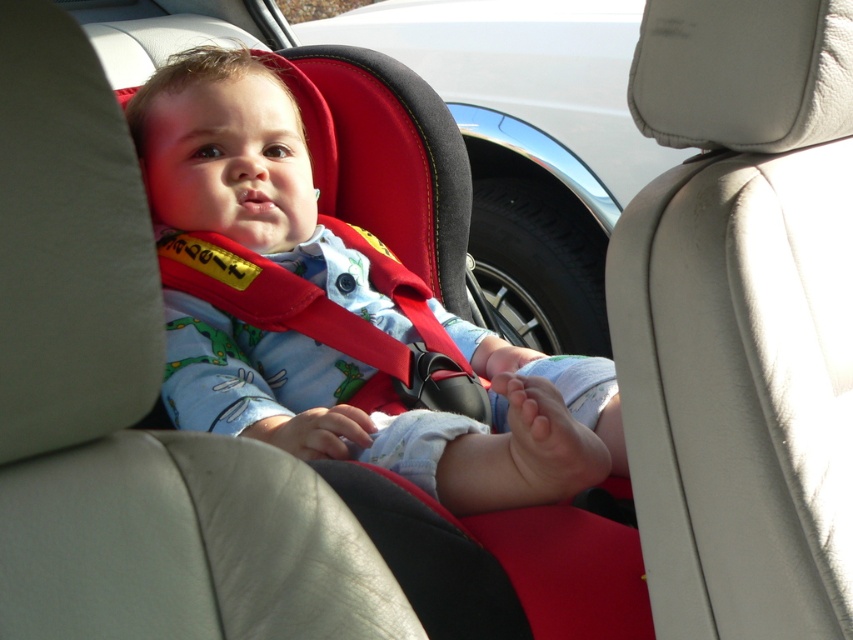
You are a parent checking the car seats in your vehicle. You notice the matte red car seat at center and the matte black car seat at upper center. Which one is positioned lower in the vehicle?

The matte red car seat at center is positioned lower than the matte black car seat at upper center, so the matte red car seat at center is lower in the vehicle.

You are a parent trying to secure your baby in the car. You have a 3.5 feet long strap to connect the two car seats. Will the strap be long enough to reach between the matte red car seat at center and the matte black car seat at upper center?

The matte red car seat at center and the matte black car seat at upper center are 5.09 feet apart from each other. Since the strap is only 3.5 feet long, it will not be long enough to reach between them.

You are a parent trying to choose between two car seats for your baby. You notice the matte red car seat at center and the matte black car seat at upper center. Which one is narrower?

The matte red car seat at center is narrower than the matte black car seat at upper center.